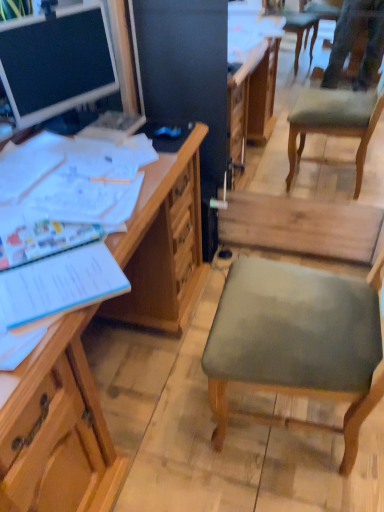
Question: Should I look upward or downward to see blue paper notebook at left?

Choices:
 (A) down
 (B) up

Answer: (A)

Question: Is blue paper notebook at left turned away from wooden desk at left, which appears as the first desk when ordered from the bottom?

Choices:
 (A) yes
 (B) no

Answer: (B)

Question: Can you confirm if blue paper notebook at left is taller than wooden desk at left, the 2th desk from the top?

Choices:
 (A) no
 (B) yes

Answer: (A)

Question: Can wooden desk at left, the 2th desk from the top, be found inside blue paper notebook at left?

Choices:
 (A) yes
 (B) no

Answer: (B)

Question: Is blue paper notebook at left next to wooden desk at left, the 2th desk from the top, and touching it?

Choices:
 (A) no
 (B) yes

Answer: (A)

Question: Are blue paper notebook at left and wooden desk at left, the 2th desk from the top, far apart?

Choices:
 (A) yes
 (B) no

Answer: (B)

Question: Does blue paper notebook at left appear on the right side of wooden desk at left, which appears as the first desk when ordered from the bottom?

Choices:
 (A) yes
 (B) no

Answer: (A)

Question: Is the depth of blue paper notebook at left greater than that of matte wooden desk at upper left, the 1th desk in the top-to-bottom sequence?

Choices:
 (A) yes
 (B) no

Answer: (B)

Question: Could matte wooden desk at upper left, the 1th desk in the top-to-bottom sequence, be considered to be inside blue paper notebook at left?

Choices:
 (A) no
 (B) yes

Answer: (A)

Question: From the image's perspective, is blue paper notebook at left located above matte wooden desk at upper left, the 1th desk in the top-to-bottom sequence?

Choices:
 (A) no
 (B) yes

Answer: (A)

Question: Is blue paper notebook at left far away from matte wooden desk at upper left, the 1th desk in the top-to-bottom sequence?

Choices:
 (A) no
 (B) yes

Answer: (A)

Question: Is blue paper notebook at left to the right of matte wooden desk at upper left, the 1th desk in the top-to-bottom sequence, from the viewer's perspective?

Choices:
 (A) no
 (B) yes

Answer: (B)

Question: Can you confirm if blue paper notebook at left is taller than matte wooden desk at upper left, which is counted as the second desk, starting from the bottom?

Choices:
 (A) yes
 (B) no

Answer: (B)

Question: Is wooden desk at left, the 2th desk from the top, not inside blue paper notebook at left?

Choices:
 (A) yes
 (B) no

Answer: (A)